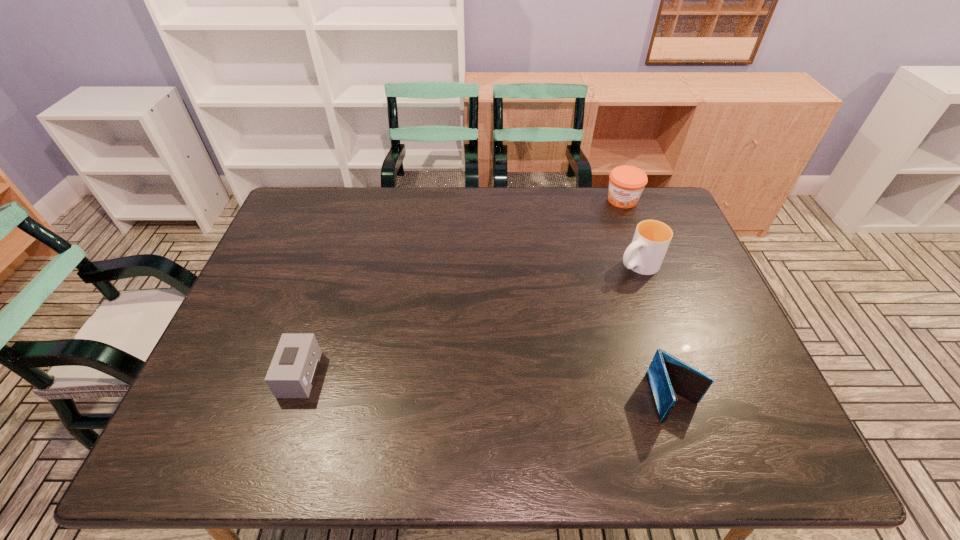
This screenshot has width=960, height=540. Identify the location of object that stands as the closest to the farthest object. (645, 254).

Locate an element on the screen. This screenshot has height=540, width=960. free spot that satisfies the following two spatial constraints: 1. on the back side of the third nearest object; 2. on the left side of the jam is located at coordinates coord(614,200).

Image resolution: width=960 pixels, height=540 pixels. In order to click on free space that satisfies the following two spatial constraints: 1. on the back side of the jam; 2. on the left side of the second farthest object in this screenshot , I will do `click(614, 200)`.